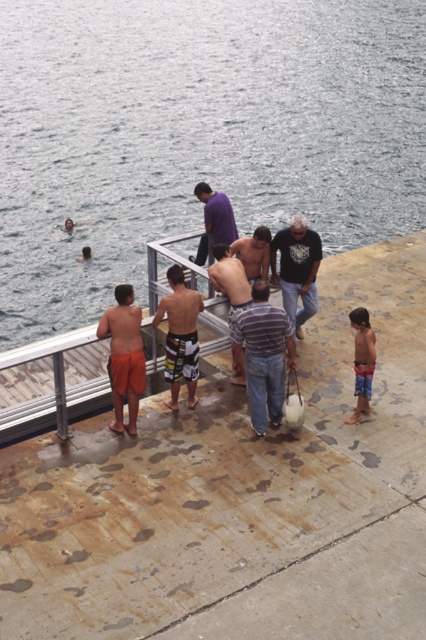
Is the position of striped cotton shirt at center more distant than that of shiny metallic shirt at center?

No, striped cotton shirt at center is closer to the viewer.

Who is higher up, striped cotton shirt at center or shiny metallic shirt at center?

shiny metallic shirt at center is above.

Where is `striped cotton shirt at center`? The height and width of the screenshot is (640, 426). striped cotton shirt at center is located at coordinates click(264, 355).

Who is positioned more to the left, multicolored striped shorts at center or purple matte shirt at center?

From the viewer's perspective, multicolored striped shorts at center appears more on the left side.

Does multicolored striped shorts at center appear on the right side of purple matte shirt at center?

In fact, multicolored striped shorts at center is to the left of purple matte shirt at center.

Measure the distance between multicolored striped shorts at center and camera.

They are 8.71 meters apart.

The width and height of the screenshot is (426, 640). Find the location of `multicolored striped shorts at center`. multicolored striped shorts at center is located at coordinates (180, 336).

Does clear water at upper left appear on the right side of blue striped shorts at lower right?

In fact, clear water at upper left is to the left of blue striped shorts at lower right.

Is clear water at upper left bigger than blue striped shorts at lower right?

Indeed, clear water at upper left has a larger size compared to blue striped shorts at lower right.

Is point (85, 60) positioned after point (373, 346)?

Yes, point (85, 60) is behind point (373, 346).

Where is `clear water at upper left`? The height and width of the screenshot is (640, 426). clear water at upper left is located at coordinates (195, 132).